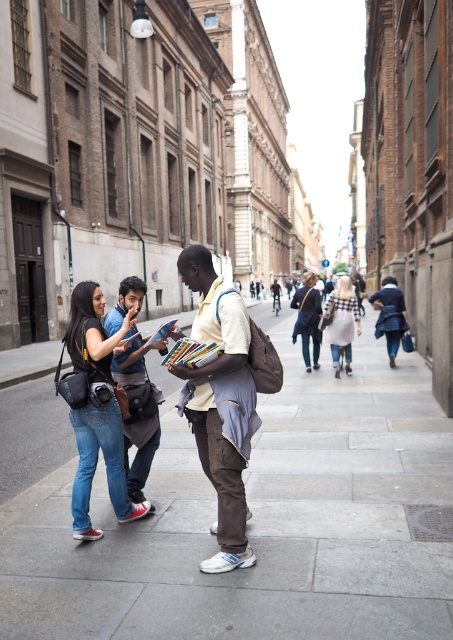
Question: Based on their relative distances, which object is farther from the denim jeans at center?

Choices:
 (A) matte black jacket at center
 (B) light yellow fabric shirt at center
 (C) gray concrete pavement at center
 (D) white checkered dress at center

Answer: (A)

Question: Can you confirm if light yellow fabric shirt at center is positioned below matte blue jeans at center?

Choices:
 (A) yes
 (B) no

Answer: (B)

Question: Can you confirm if denim jeans at center is bigger than white checkered dress at center?

Choices:
 (A) no
 (B) yes

Answer: (A)

Question: Observing the image, what is the correct spatial positioning of matte blue jeans at center in reference to white checkered dress at center?

Choices:
 (A) right
 (B) left

Answer: (B)

Question: Which object is positioned farthest from the matte black jacket at center?

Choices:
 (A) denim jeans at center
 (B) gray concrete pavement at center

Answer: (A)

Question: Considering the real-world distances, which object is closest to the light yellow fabric shirt at center?

Choices:
 (A) gray concrete pavement at center
 (B) white checkered dress at center
 (C) matte blue jeans at center
 (D) denim jeans at center

Answer: (C)